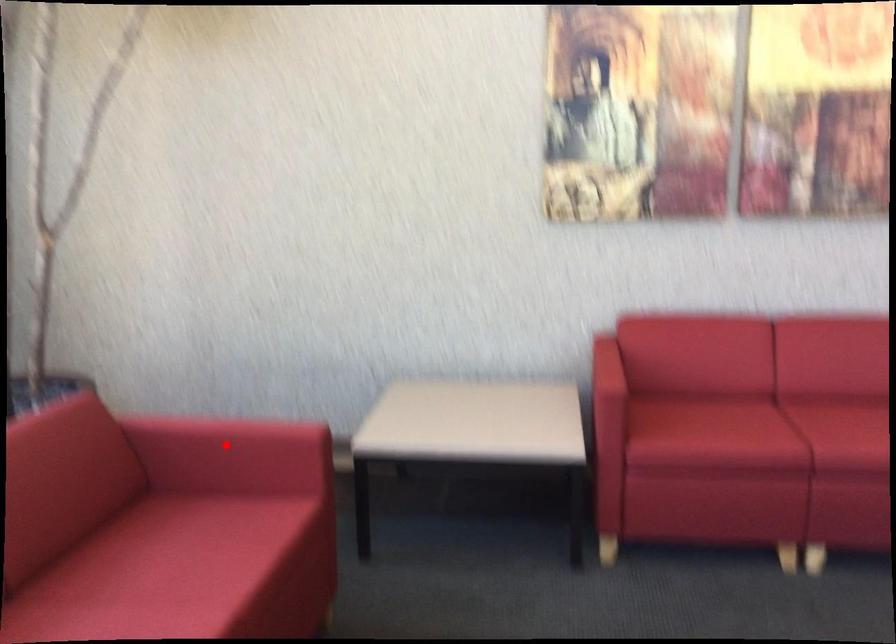
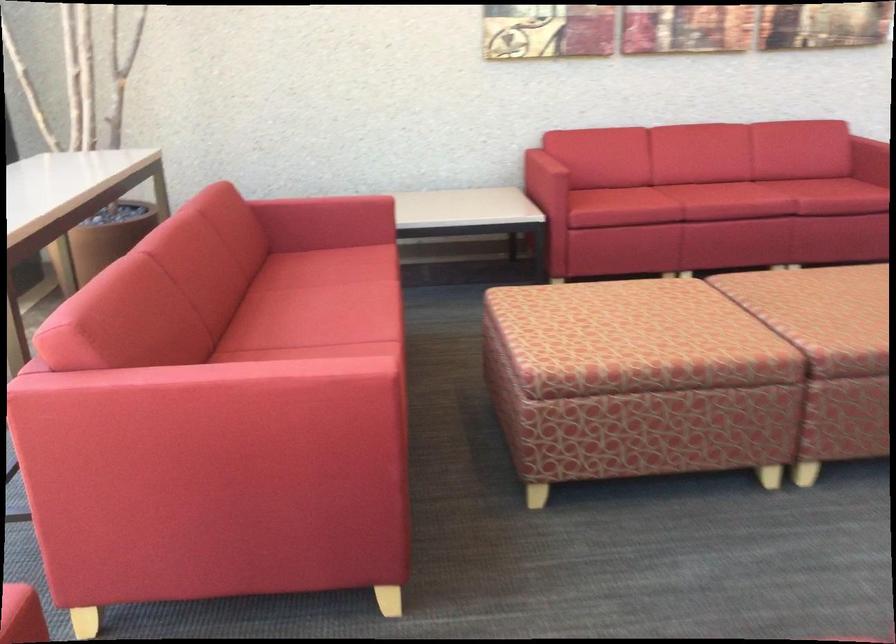
In the second image, find the point that corresponds to the highlighted location in the first image.

(326, 207)